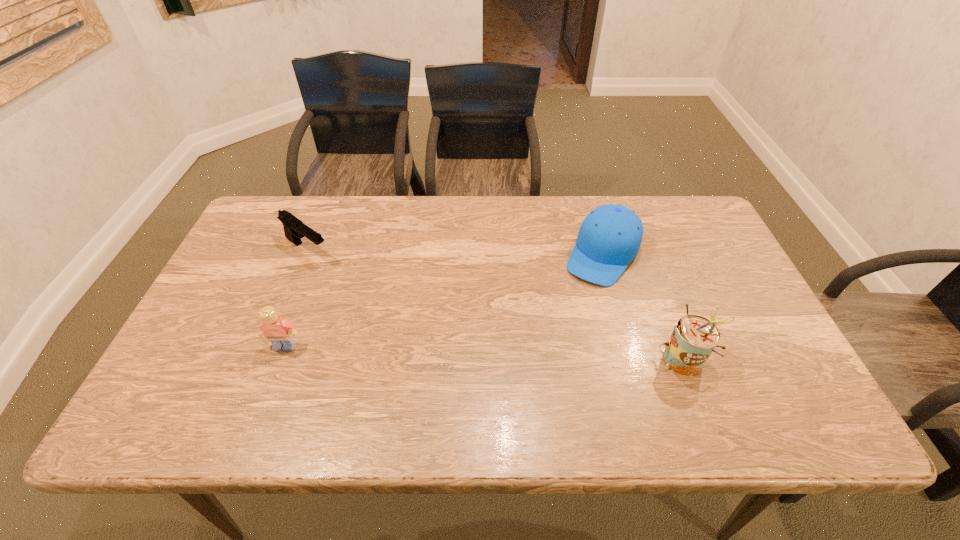
At what (x,y) coordinates should I click in order to perform the action: click on Lego. Please return your answer as a coordinate pair (x, y). Looking at the image, I should click on (278, 331).

Identify the location of can. The height and width of the screenshot is (540, 960). (694, 338).

Locate an element on the screen. Image resolution: width=960 pixels, height=540 pixels. cap is located at coordinates (609, 238).

The width and height of the screenshot is (960, 540). What are the coordinates of `pistol` in the screenshot? It's located at (294, 229).

The width and height of the screenshot is (960, 540). In order to click on vacant area situated 0.110m on the front-facing side of the Lego in this screenshot , I will do `click(267, 393)`.

The width and height of the screenshot is (960, 540). Find the location of `free space located on the back of the can`. free space located on the back of the can is located at coordinates (652, 272).

Locate an element on the screen. The image size is (960, 540). free space located 0.190m on the front-facing side of the cap is located at coordinates (561, 329).

Where is `free spot located 0.290m on the front-facing side of the cap`? Image resolution: width=960 pixels, height=540 pixels. free spot located 0.290m on the front-facing side of the cap is located at coordinates (542, 359).

Where is `vacant area located 0.250m on the front-facing side of the cap`? The width and height of the screenshot is (960, 540). vacant area located 0.250m on the front-facing side of the cap is located at coordinates (550, 347).

Locate an element on the screen. The image size is (960, 540). vacant space situated 0.220m on the front-facing side of the pistol is located at coordinates (377, 298).